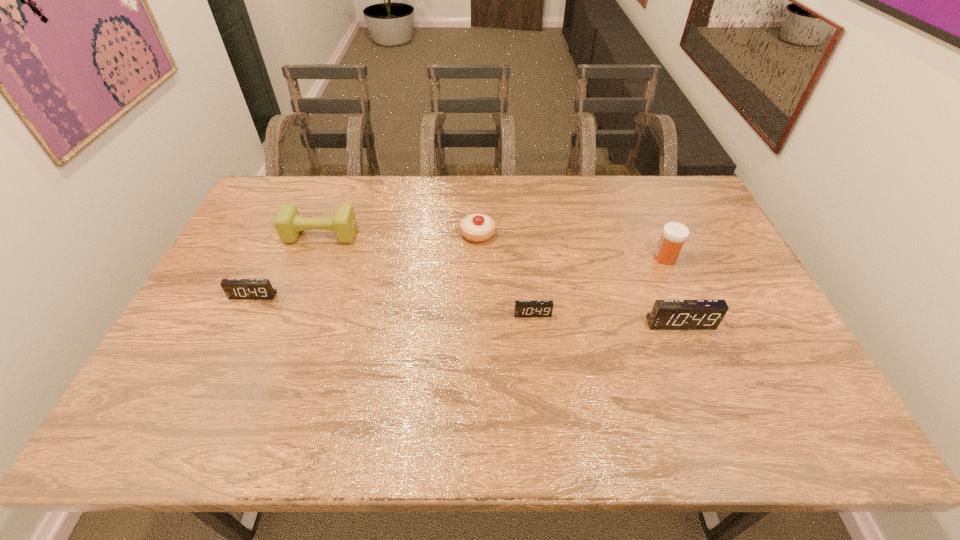
To achieve uniform spacing by inserting another alarm_clock among them, please point to a free space for this new alarm_clock. Please provide its 2D coordinates. Your answer should be formatted as a tuple, i.e. [(x, y)], where the tuple contains the x and y coordinates of a point satisfying the conditions above.

[(390, 305)]